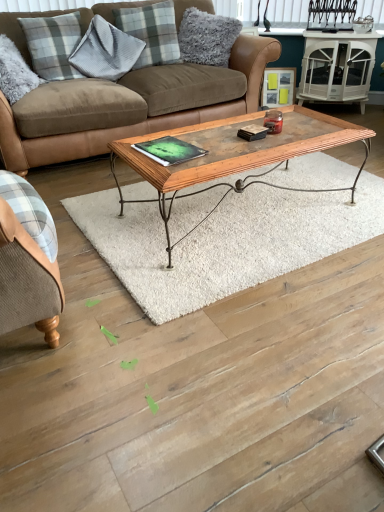
I want to click on blank space situated above gray plaid pillow at upper left, the 4th pillow viewed from the right (from a real-world perspective), so click(x=61, y=11).